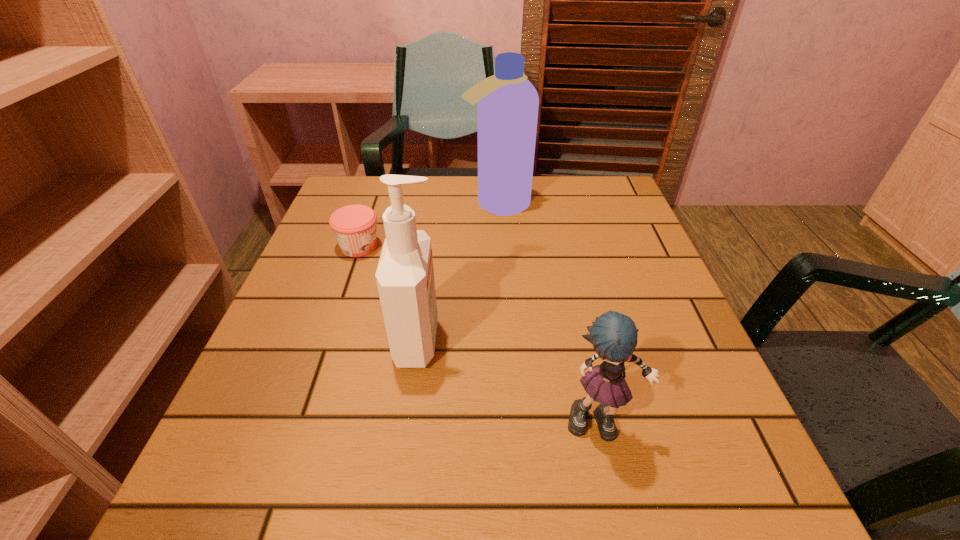
This screenshot has height=540, width=960. What are the coordinates of `shampoo` in the screenshot? It's located at (507, 103).

Find the location of a particular element. The width and height of the screenshot is (960, 540). the third farthest object is located at coordinates (405, 280).

Find the location of `the second object from left to right`. the second object from left to right is located at coordinates (405, 280).

Identify the location of rag doll. The height and width of the screenshot is (540, 960). (613, 335).

Where is `the third tallest object`? the third tallest object is located at coordinates (613, 335).

The image size is (960, 540). I want to click on the shortest object, so click(354, 226).

At what (x,y) coordinates should I click in order to perform the action: click on the leftmost object. Please return your answer as a coordinate pair (x, y). The image size is (960, 540). Looking at the image, I should click on (354, 226).

Locate an element on the screen. This screenshot has width=960, height=540. vacant area situated 0.320m on the left of the farthest object is located at coordinates (340, 204).

Where is `vacant region located 0.090m on the front label of the second object from left to right`? vacant region located 0.090m on the front label of the second object from left to right is located at coordinates (492, 341).

Where is `vacant position located 0.070m on the front-facing side of the rag doll`? This screenshot has width=960, height=540. vacant position located 0.070m on the front-facing side of the rag doll is located at coordinates (617, 495).